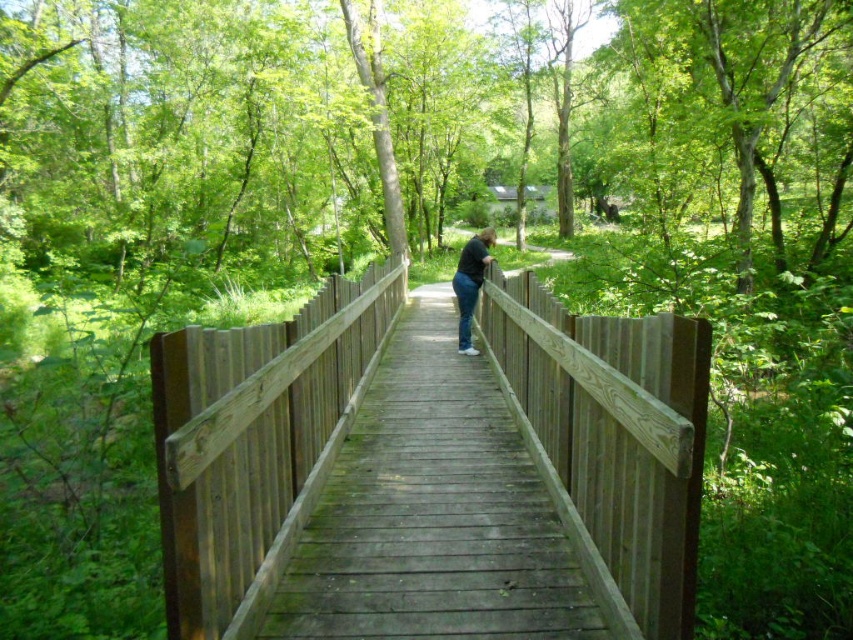
Question: Does wooden bridge at center have a smaller size compared to dark blue jeans at center?

Choices:
 (A) yes
 (B) no

Answer: (A)

Question: Does wooden bridge at center have a greater width compared to dark blue jeans at center?

Choices:
 (A) yes
 (B) no

Answer: (B)

Question: Among these objects, which one is farthest from the camera?

Choices:
 (A) wooden bridge at center
 (B) dark blue jeans at center

Answer: (B)

Question: Can you confirm if wooden bridge at center is positioned above dark blue jeans at center?

Choices:
 (A) yes
 (B) no

Answer: (B)